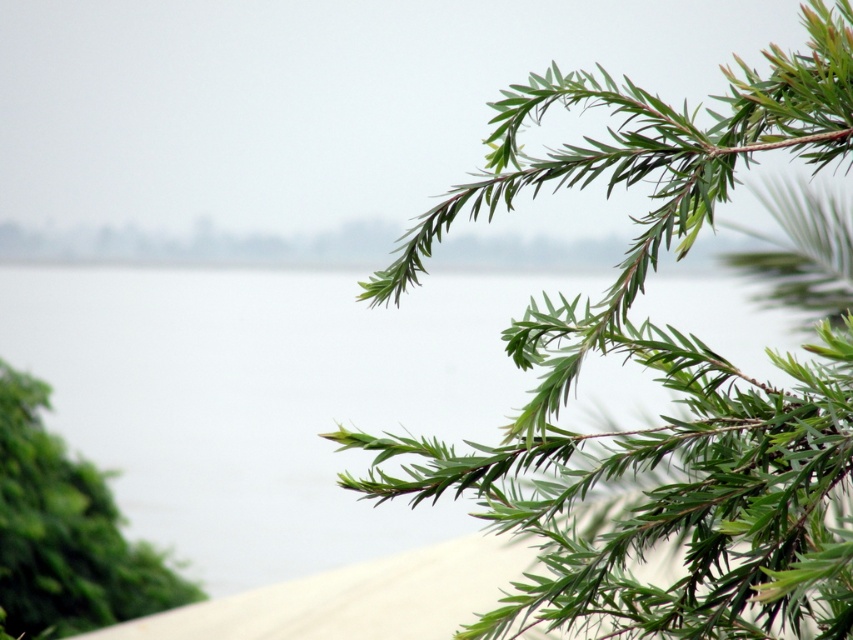
You are standing at point A, which is at point (738, 134). You want to walk to point B, which is 5.56 feet away. The path is clear except for a small stream that flows diagonally from the bottom left to the top right of the scene. The stream is 3 feet wide. Can you cross the stream safely without getting your shoes wet?

The distance between point A and point B is 5.56 feet. The stream is 3 feet wide. Since the stream is narrower than the total distance, you can cross it safely by stepping over it, provided you can jump or step across the 3 feet width. However, the exact path and feasibility depend on the slope and your ability to navigate the stream. The description does not mention any obstacles beyond the stream width, so assuming the stream is passable, you can cross it without getting wet if you can manage the 3 feet.